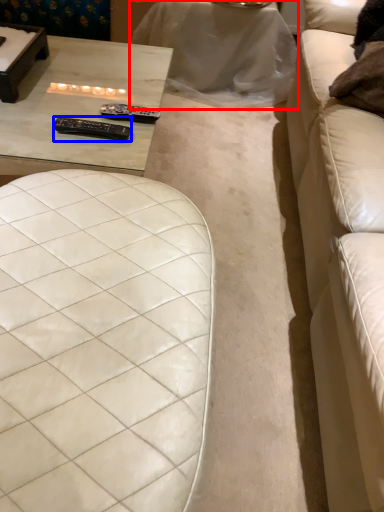
Question: Among these objects, which one is farthest to the camera, table (highlighted by a red box) or remote (highlighted by a blue box)?

Choices:
 (A) table
 (B) remote

Answer: (A)